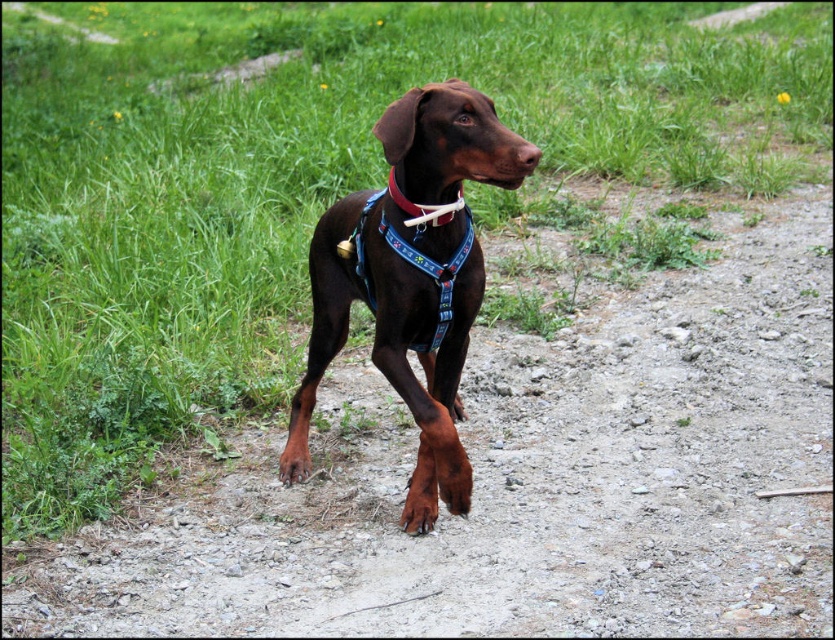
Based on the photo, can you confirm if dirt track at center is bigger than shiny brown dog at center?

Indeed, dirt track at center has a larger size compared to shiny brown dog at center.

Is point (545, 387) farther from viewer compared to point (438, 292)?

Yes, it is.

Locate an element on the screen. The width and height of the screenshot is (835, 640). dirt track at center is located at coordinates point(515,481).

Does dirt track at center lie in front of smooth red collar at center?

That is True.

Is dirt track at center bigger than smooth red collar at center?

Correct, dirt track at center is larger in size than smooth red collar at center.

Locate an element on the screen. The height and width of the screenshot is (640, 835). dirt track at center is located at coordinates (515, 481).

Does shiny brown dog at center have a smaller size compared to smooth red collar at center?

Actually, shiny brown dog at center might be larger than smooth red collar at center.

Which is below, shiny brown dog at center or smooth red collar at center?

shiny brown dog at center is lower down.

Image resolution: width=835 pixels, height=640 pixels. I want to click on shiny brown dog at center, so click(x=396, y=333).

Find the location of a particular element. The width and height of the screenshot is (835, 640). shiny brown dog at center is located at coordinates (396, 333).